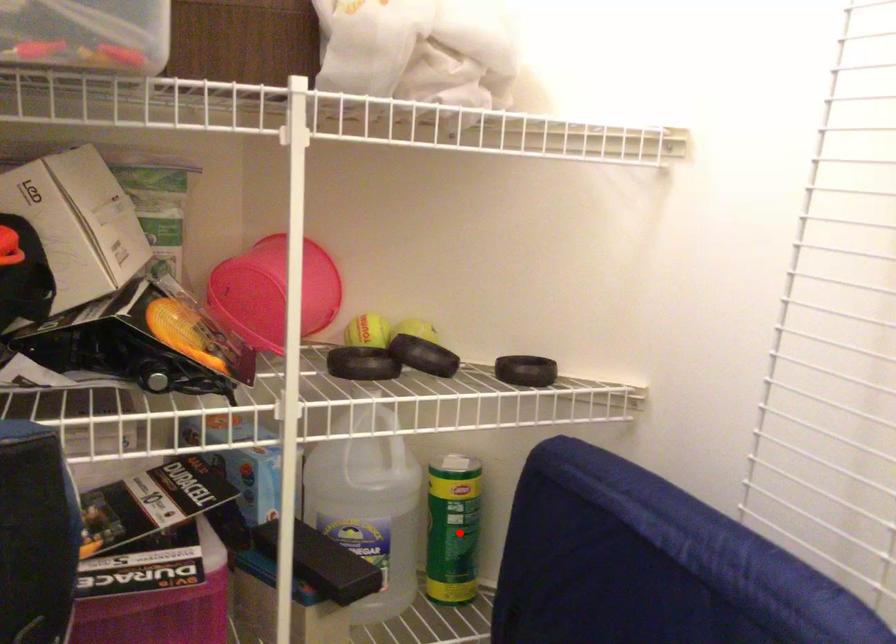
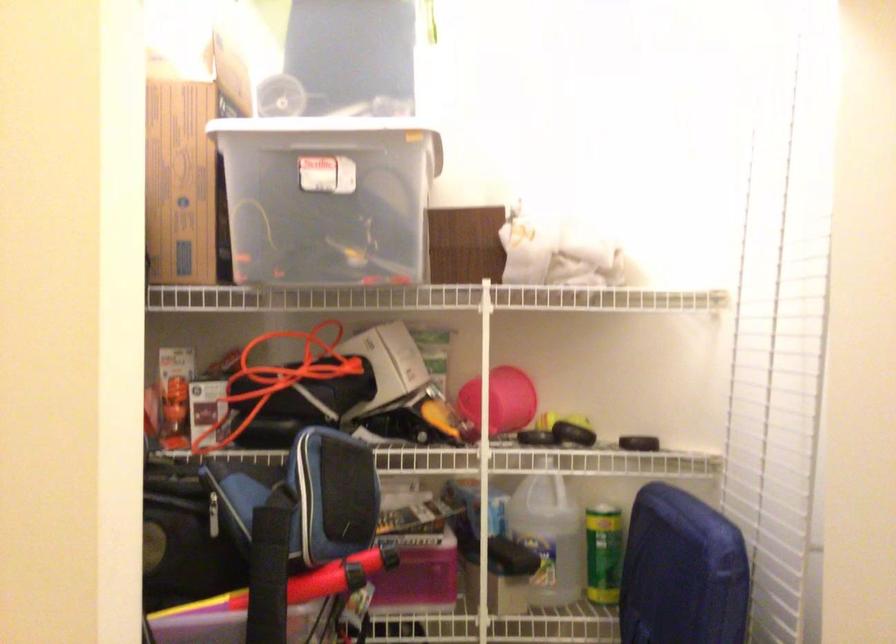
Question: I am providing you with two images of the same scene from different viewpoints. In image1, a red point is highlighted. Considering the same 3D point in image2, which of the following is correct?

Choices:
 (A) It is closer
 (B) It is farther

Answer: (B)